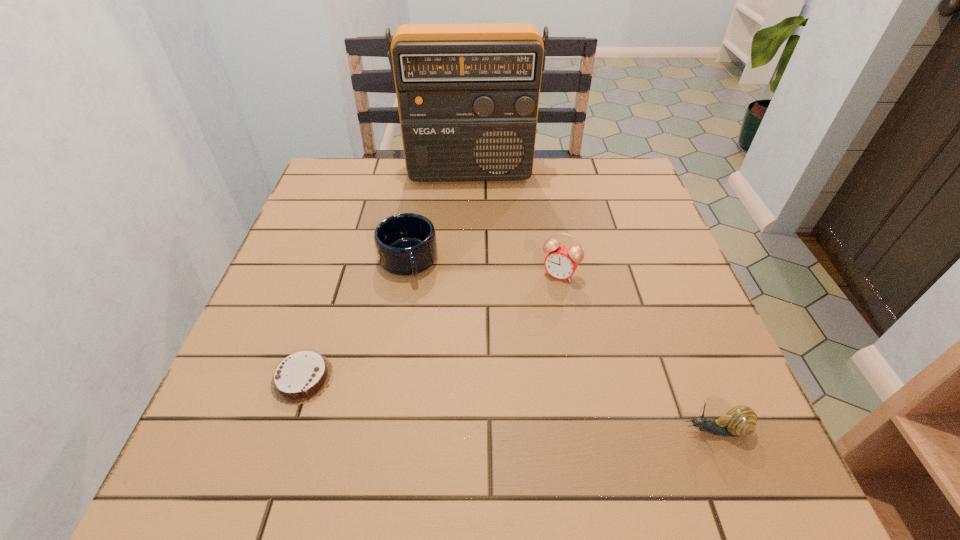
Locate an element on the screen. The width and height of the screenshot is (960, 540). empty space that is in between the mug and the fourth shortest object is located at coordinates (484, 267).

The height and width of the screenshot is (540, 960). Find the location of `vacant space in between the tallest object and the mug`. vacant space in between the tallest object and the mug is located at coordinates (439, 217).

Where is `free space between the radio receiver and the nearest object`? free space between the radio receiver and the nearest object is located at coordinates (592, 301).

Where is `vacant area between the third tallest object and the nearest object`? vacant area between the third tallest object and the nearest object is located at coordinates (562, 345).

Identify which object is the closest to the chocolate cake. Please provide its 2D coordinates. Your answer should be formatted as a tuple, i.e. [(x, y)], where the tuple contains the x and y coordinates of a point satisfying the conditions above.

[(405, 243)]

Where is `object that is the third closest to the third tallest object`? object that is the third closest to the third tallest object is located at coordinates (561, 262).

This screenshot has width=960, height=540. Find the location of `free spot that satisfies the following two spatial constraints: 1. on the front side of the tallest object; 2. on the front-facing side of the fourth tallest object`. free spot that satisfies the following two spatial constraints: 1. on the front side of the tallest object; 2. on the front-facing side of the fourth tallest object is located at coordinates (462, 430).

Locate an element on the screen. The image size is (960, 540). free spot that satisfies the following two spatial constraints: 1. on the back side of the alarm clock; 2. on the left side of the shortest object is located at coordinates (337, 274).

In order to click on free spot that satisfies the following two spatial constraints: 1. on the back side of the fourth shortest object; 2. on the left side of the leftmost object in this screenshot , I will do `click(337, 274)`.

You are a GUI agent. You are given a task and a screenshot of the screen. Output one action in this format:
    pyautogui.click(x=<x>, y=<y>)
    Task: Click on the vacant region that satisfies the following two spatial constraints: 1. on the front side of the escargot; 2. on the front-facing side of the alarm clock
    This screenshot has height=540, width=960.
    Given the screenshot: What is the action you would take?
    pyautogui.click(x=588, y=430)